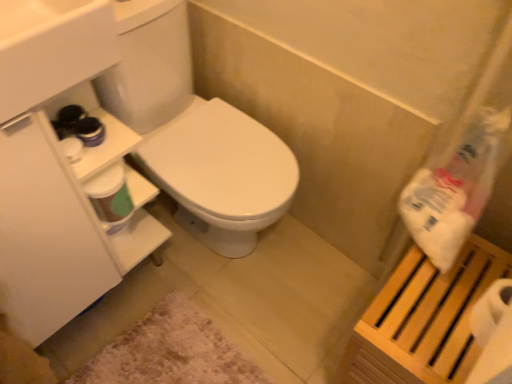
Image resolution: width=512 pixels, height=384 pixels. I want to click on free spot above white fluffy bath mat at lower center (from a real-world perspective), so click(x=177, y=353).